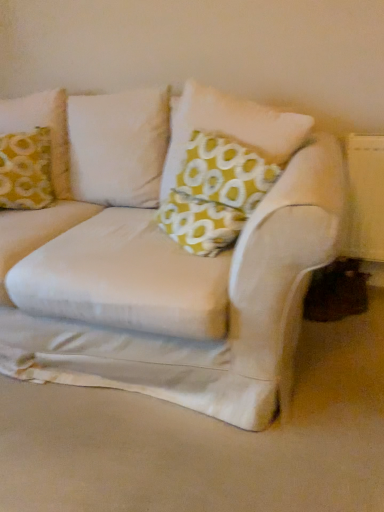
Where is `yellow fabric pillow at upper left, the second pillow positioned from the right`? The width and height of the screenshot is (384, 512). yellow fabric pillow at upper left, the second pillow positioned from the right is located at coordinates (43, 126).

The height and width of the screenshot is (512, 384). What do you see at coordinates (43, 126) in the screenshot?
I see `yellow fabric pillow at upper left, marked as the 1th pillow in a left-to-right arrangement` at bounding box center [43, 126].

The width and height of the screenshot is (384, 512). What do you see at coordinates (222, 165) in the screenshot?
I see `yellow fabric pillow at center, the 2th pillow when ordered from left to right` at bounding box center [222, 165].

Where is `yellow fabric pillow at center, which is counted as the 1th pillow, starting from the right`? Image resolution: width=384 pixels, height=512 pixels. yellow fabric pillow at center, which is counted as the 1th pillow, starting from the right is located at coordinates (222, 165).

The image size is (384, 512). I want to click on yellow fabric pillow at upper left, the second pillow positioned from the right, so click(x=43, y=126).

Is yellow fabric pillow at center, the 2th pillow when ordered from left to right, at the right side of yellow fabric pillow at upper left, the second pillow positioned from the right?

Yes.

Is yellow fabric pillow at center, which is counted as the 1th pillow, starting from the right, further to camera compared to yellow fabric pillow at upper left, marked as the 1th pillow in a left-to-right arrangement?

No, yellow fabric pillow at center, which is counted as the 1th pillow, starting from the right, is in front of yellow fabric pillow at upper left, marked as the 1th pillow in a left-to-right arrangement.

Which is in front, point (179, 165) or point (51, 104)?

The point (179, 165) is closer to the camera.

From the image's perspective, is yellow fabric pillow at center, the 2th pillow when ordered from left to right, positioned above or below yellow fabric pillow at upper left, the second pillow positioned from the right?

Clearly, from the image's perspective, yellow fabric pillow at center, the 2th pillow when ordered from left to right, is below yellow fabric pillow at upper left, the second pillow positioned from the right.

From a real-world perspective, is yellow fabric pillow at center, which is counted as the 1th pillow, starting from the right, beneath yellow fabric pillow at upper left, marked as the 1th pillow in a left-to-right arrangement?

Incorrect, from a real-world perspective, yellow fabric pillow at center, which is counted as the 1th pillow, starting from the right, is higher than yellow fabric pillow at upper left, marked as the 1th pillow in a left-to-right arrangement.

Looking at this image, considering the relative sizes of yellow fabric pillow at center, the 2th pillow when ordered from left to right, and yellow fabric pillow at upper left, the second pillow positioned from the right, in the image provided, is yellow fabric pillow at center, the 2th pillow when ordered from left to right, thinner than yellow fabric pillow at upper left, the second pillow positioned from the right,?

Yes.

Considering the sizes of objects yellow fabric pillow at center, which is counted as the 1th pillow, starting from the right, and yellow fabric pillow at upper left, the second pillow positioned from the right, in the image provided, who is taller, yellow fabric pillow at center, which is counted as the 1th pillow, starting from the right, or yellow fabric pillow at upper left, the second pillow positioned from the right,?

With more height is yellow fabric pillow at center, which is counted as the 1th pillow, starting from the right.

Which of these two, yellow fabric pillow at center, the 2th pillow when ordered from left to right, or yellow fabric pillow at upper left, the second pillow positioned from the right, is bigger?

yellow fabric pillow at center, the 2th pillow when ordered from left to right.

Would you say yellow fabric pillow at center, which is counted as the 1th pillow, starting from the right, contains yellow fabric pillow at upper left, marked as the 1th pillow in a left-to-right arrangement?

Definitely not — yellow fabric pillow at upper left, marked as the 1th pillow in a left-to-right arrangement, is not inside yellow fabric pillow at center, which is counted as the 1th pillow, starting from the right.

Are yellow fabric pillow at center, the 2th pillow when ordered from left to right, and yellow fabric pillow at upper left, marked as the 1th pillow in a left-to-right arrangement, beside each other?

No, yellow fabric pillow at center, the 2th pillow when ordered from left to right, is not touching yellow fabric pillow at upper left, marked as the 1th pillow in a left-to-right arrangement.

Is yellow fabric pillow at center, the 2th pillow when ordered from left to right, turned away from yellow fabric pillow at upper left, marked as the 1th pillow in a left-to-right arrangement?

No, yellow fabric pillow at center, the 2th pillow when ordered from left to right,'s orientation is not away from yellow fabric pillow at upper left, marked as the 1th pillow in a left-to-right arrangement.

The image size is (384, 512). I want to click on pillow lying on the right of yellow fabric pillow at upper left, the second pillow positioned from the right, so click(222, 165).

Considering the positions of objects yellow fabric pillow at upper left, the second pillow positioned from the right, and yellow fabric pillow at center, the 2th pillow when ordered from left to right, in the image provided, who is more to the right, yellow fabric pillow at upper left, the second pillow positioned from the right, or yellow fabric pillow at center, the 2th pillow when ordered from left to right,?

From the viewer's perspective, yellow fabric pillow at center, the 2th pillow when ordered from left to right, appears more on the right side.

Considering their positions, is yellow fabric pillow at upper left, marked as the 1th pillow in a left-to-right arrangement, located in front of or behind yellow fabric pillow at center, which is counted as the 1th pillow, starting from the right?

Visually, yellow fabric pillow at upper left, marked as the 1th pillow in a left-to-right arrangement, is located behind yellow fabric pillow at center, which is counted as the 1th pillow, starting from the right.

Does point (62, 175) lie behind point (189, 95)?

Yes.

From the image's perspective, between yellow fabric pillow at upper left, marked as the 1th pillow in a left-to-right arrangement, and yellow fabric pillow at center, which is counted as the 1th pillow, starting from the right, which one is located above?

yellow fabric pillow at upper left, marked as the 1th pillow in a left-to-right arrangement.

From a real-world perspective, is yellow fabric pillow at upper left, marked as the 1th pillow in a left-to-right arrangement, physically below yellow fabric pillow at center, the 2th pillow when ordered from left to right?

Yes, from a real-world perspective, yellow fabric pillow at upper left, marked as the 1th pillow in a left-to-right arrangement, is beneath yellow fabric pillow at center, the 2th pillow when ordered from left to right.

Which object is thinner, yellow fabric pillow at upper left, the second pillow positioned from the right, or yellow fabric pillow at center, the 2th pillow when ordered from left to right?

yellow fabric pillow at center, the 2th pillow when ordered from left to right.

Considering the relative sizes of yellow fabric pillow at upper left, the second pillow positioned from the right, and yellow fabric pillow at center, the 2th pillow when ordered from left to right, in the image provided, is yellow fabric pillow at upper left, the second pillow positioned from the right, taller than yellow fabric pillow at center, the 2th pillow when ordered from left to right,?

No.

Considering the sizes of objects yellow fabric pillow at upper left, marked as the 1th pillow in a left-to-right arrangement, and yellow fabric pillow at center, which is counted as the 1th pillow, starting from the right, in the image provided, who is smaller, yellow fabric pillow at upper left, marked as the 1th pillow in a left-to-right arrangement, or yellow fabric pillow at center, which is counted as the 1th pillow, starting from the right,?

yellow fabric pillow at upper left, marked as the 1th pillow in a left-to-right arrangement.

Do you think yellow fabric pillow at upper left, marked as the 1th pillow in a left-to-right arrangement, is within yellow fabric pillow at center, the 2th pillow when ordered from left to right, or outside of it?

yellow fabric pillow at upper left, marked as the 1th pillow in a left-to-right arrangement, is spatially situated outside yellow fabric pillow at center, the 2th pillow when ordered from left to right.

Would you say yellow fabric pillow at upper left, marked as the 1th pillow in a left-to-right arrangement, is a long distance from yellow fabric pillow at center, which is counted as the 1th pillow, starting from the right?

They are positioned close to each other.

Could you tell me if yellow fabric pillow at upper left, the second pillow positioned from the right, is facing yellow fabric pillow at center, the 2th pillow when ordered from left to right?

No.

What's the angular difference between yellow fabric pillow at upper left, marked as the 1th pillow in a left-to-right arrangement, and yellow fabric pillow at center, the 2th pillow when ordered from left to right,'s facing directions?

There is a 49.3-degree angle between the facing directions of yellow fabric pillow at upper left, marked as the 1th pillow in a left-to-right arrangement, and yellow fabric pillow at center, the 2th pillow when ordered from left to right.

Identify the location of pillow in front of the yellow fabric pillow at upper left, marked as the 1th pillow in a left-to-right arrangement. click(x=222, y=165).

Find the location of a particular element. The width and height of the screenshot is (384, 512). pillow below the yellow fabric pillow at center, the 2th pillow when ordered from left to right (from a real-world perspective) is located at coordinates (x=43, y=126).

What are the coordinates of `pillow behind the yellow fabric pillow at center, which is counted as the 1th pillow, starting from the right` in the screenshot? It's located at (43, 126).